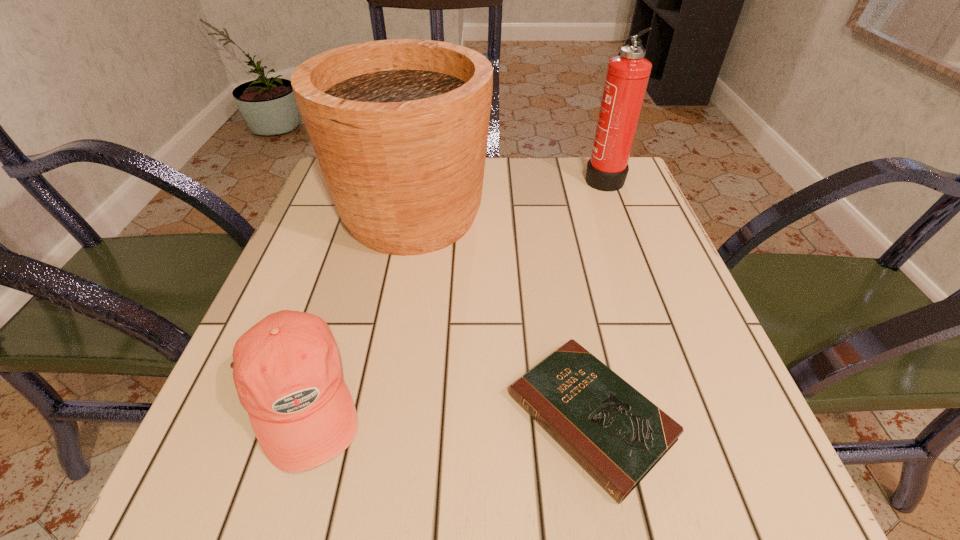
Find the location of a particular element. The height and width of the screenshot is (540, 960). vacant area that lies between the flowerpot and the third tallest object is located at coordinates (355, 307).

This screenshot has height=540, width=960. In order to click on free space between the baseball cap and the fire extinguisher in this screenshot , I will do `click(451, 288)`.

At what (x,y) coordinates should I click in order to perform the action: click on vacant space that is in between the second shortest object and the shortest object. Please return your answer as a coordinate pair (x, y). The height and width of the screenshot is (540, 960). Looking at the image, I should click on (444, 408).

At what (x,y) coordinates should I click in order to perform the action: click on vacant area that lies between the fire extinguisher and the Bible. Please return your answer as a coordinate pair (x, y). Image resolution: width=960 pixels, height=540 pixels. Looking at the image, I should click on (597, 297).

Image resolution: width=960 pixels, height=540 pixels. I want to click on free spot between the fire extinguisher and the baseball cap, so click(451, 288).

You are a GUI agent. You are given a task and a screenshot of the screen. Output one action in this format:
    pyautogui.click(x=<x>, y=<y>)
    Task: Click on the free spot between the flowerpot and the Bible
    Image resolution: width=960 pixels, height=540 pixels.
    Given the screenshot: What is the action you would take?
    pyautogui.click(x=501, y=316)

This screenshot has width=960, height=540. What are the coordinates of `the second closest object to the baseball cap` in the screenshot? It's located at (617, 435).

The height and width of the screenshot is (540, 960). Identify the location of object that is the second closest to the flowerpot. (617, 435).

This screenshot has height=540, width=960. Find the location of `blank space that satisfies the following two spatial constraints: 1. on the front side of the Bible; 2. on the right side of the second shortest object`. blank space that satisfies the following two spatial constraints: 1. on the front side of the Bible; 2. on the right side of the second shortest object is located at coordinates (292, 417).

The image size is (960, 540). Find the location of `vacant space that satisfies the following two spatial constraints: 1. on the front-facing side of the fire extinguisher; 2. on the front side of the baseball cap`. vacant space that satisfies the following two spatial constraints: 1. on the front-facing side of the fire extinguisher; 2. on the front side of the baseball cap is located at coordinates (686, 398).